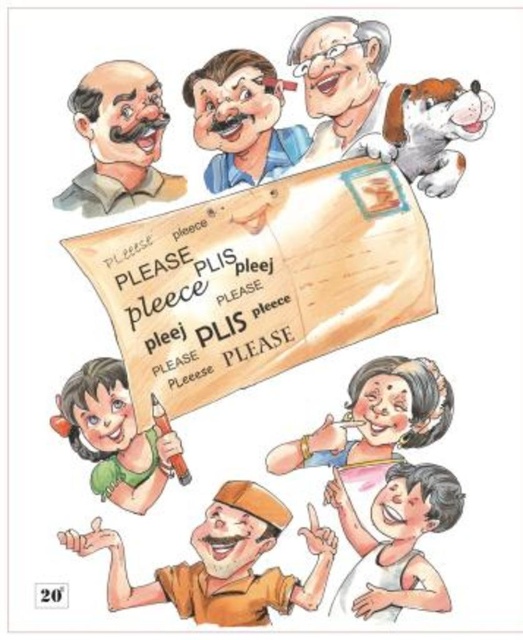
Is wooden sign at center positioned in front of brown cotton shirt at lower center?

No.

Is wooden sign at center below brown cotton shirt at lower center?

Actually, wooden sign at center is above brown cotton shirt at lower center.

Which is behind, point (385, 269) or point (320, 531)?

Point (385, 269)

The width and height of the screenshot is (523, 640). I want to click on wooden sign at center, so click(258, 280).

Does wooden sign at center have a lesser width compared to smooth white shirt at lower right?

No, wooden sign at center is not thinner than smooth white shirt at lower right.

Does wooden sign at center have a larger size compared to smooth white shirt at lower right?

Indeed, wooden sign at center has a larger size compared to smooth white shirt at lower right.

Is point (240, 323) closer to viewer compared to point (433, 608)?

No, it is behind (433, 608).

At what (x,y) coordinates should I click in order to perform the action: click on wooden sign at center. Please return your answer as a coordinate pair (x, y). The height and width of the screenshot is (640, 523). Looking at the image, I should click on (258, 280).

Between matte pink handbag at lower center and matte green pencil at lower left, which one is positioned lower?

Positioned lower is matte green pencil at lower left.

In the scene shown: Who is taller, matte pink handbag at lower center or matte green pencil at lower left?

matte green pencil at lower left is taller.

Does point (399, 403) lie behind point (117, 417)?

Yes, it is.

Identify the location of matte pink handbag at lower center. (376, 417).